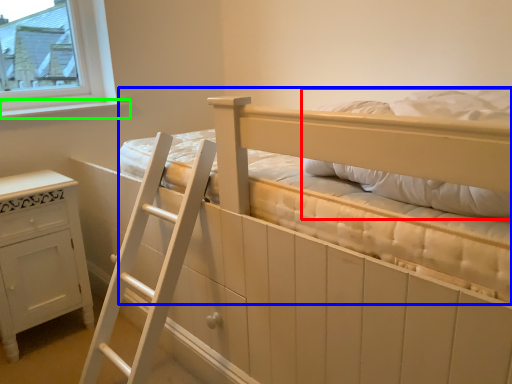
Question: Based on their relative distances, which object is farther from pillow (highlighted by a red box)? Choose from bed (highlighted by a blue box) and window sill (highlighted by a green box).

Choices:
 (A) bed
 (B) window sill

Answer: (B)